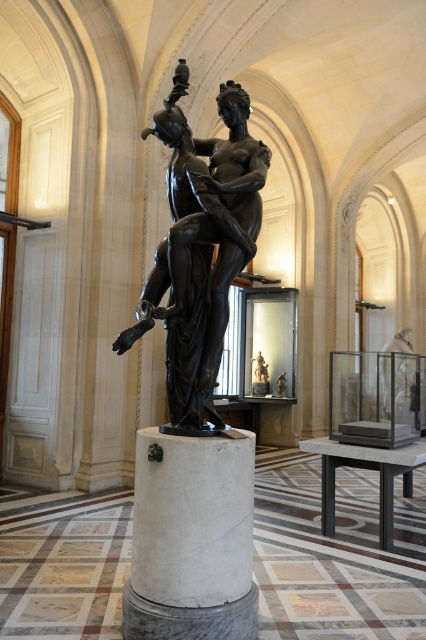
From the picture: Is bronze statue at center wider than white marble pillar at center?

Yes, bronze statue at center is wider than white marble pillar at center.

Measure the distance between bronze statue at center and camera.

bronze statue at center is 3.14 meters from camera.

I want to click on bronze statue at center, so click(x=201, y=244).